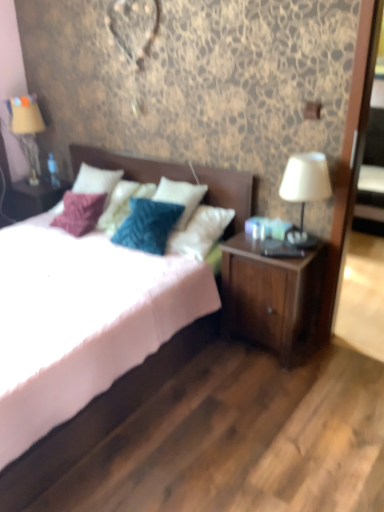
The width and height of the screenshot is (384, 512). Find the location of `vacant area located to the right-hand side of wooden nightstand at lower right`. vacant area located to the right-hand side of wooden nightstand at lower right is located at coordinates (336, 357).